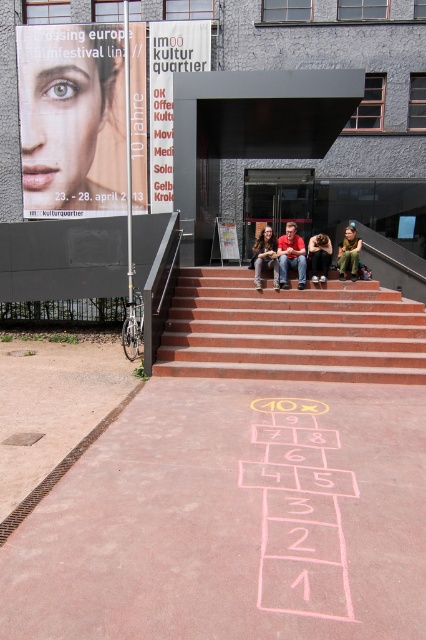
Is point (157, 97) positioned in front of point (238, 253)?

No.

Does white paper sign at upper center have a lesser height compared to white paper poster at center?

Yes.

Is point (158, 198) closer to viewer compared to point (233, 240)?

No, (158, 198) is behind (233, 240).

The image size is (426, 640). I want to click on white paper sign at upper center, so click(x=169, y=93).

Who is more forward, (186, 61) or (255, 253)?

Point (255, 253) is more forward.

Describe the element at coordinates (169, 93) in the screenshot. This screenshot has width=426, height=640. I see `white paper sign at upper center` at that location.

At what (x,y) coordinates should I click in order to perform the action: click on white paper sign at upper center. Please return your answer as a coordinate pair (x, y). Looking at the image, I should click on (169, 93).

Does dark brown leather jacket at center appear under white paper poster at center?

Indeed, dark brown leather jacket at center is positioned under white paper poster at center.

Does dark brown leather jacket at center have a lesser width compared to white paper poster at center?

Yes.

Does point (327, 250) come in front of point (232, 241)?

Yes.

Where is `dark brown leather jacket at center`? The image size is (426, 640). dark brown leather jacket at center is located at coordinates (319, 256).